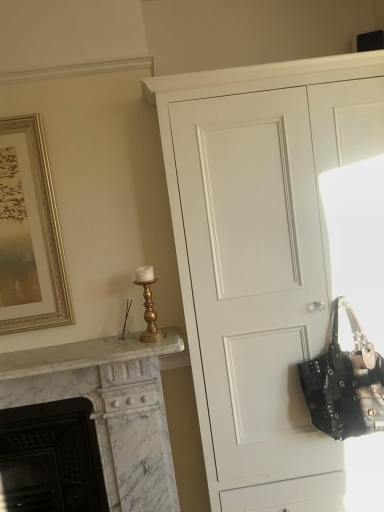
What do you see at coordinates (30, 233) in the screenshot? The width and height of the screenshot is (384, 512). I see `gold framed picture at upper left` at bounding box center [30, 233].

What do you see at coordinates (148, 305) in the screenshot? Image resolution: width=384 pixels, height=512 pixels. I see `gold metallic candlestick at upper left` at bounding box center [148, 305].

In order to face white matte cupboard at center, should I rotate leftwards or rightwards?

To align with it, rotate right about 14.891°.

Find the location of a particular element. This screenshot has height=512, width=384. gold framed picture at upper left is located at coordinates (30, 233).

Can you confirm if gold framed picture at upper left is thinner than white marble fireplace at left, the 2th fireplace when ordered from right to left?

Yes, gold framed picture at upper left is thinner than white marble fireplace at left, the 2th fireplace when ordered from right to left.

Is gold framed picture at upper left positioned far away from white marble fireplace at left, the 1th fireplace positioned from the left?

gold framed picture at upper left is near white marble fireplace at left, the 1th fireplace positioned from the left, not far away.

Between gold framed picture at upper left and white marble fireplace at left, the 1th fireplace positioned from the left, which one is positioned in front?

gold framed picture at upper left.

Considering the sizes of objects gold framed picture at upper left and white marble fireplace at left, the 2th fireplace when ordered from right to left, in the image provided, who is bigger, gold framed picture at upper left or white marble fireplace at left, the 2th fireplace when ordered from right to left,?

white marble fireplace at left, the 2th fireplace when ordered from right to left.

Is point (357, 390) farther from camera compared to point (31, 437)?

No, (357, 390) is in front of (31, 437).

Which of these two, studded leather handbag at right or white marble fireplace at left, the 2th fireplace when ordered from right to left, is smaller?

studded leather handbag at right is smaller.

From a real-world perspective, does studded leather handbag at right sit lower than white marble fireplace at left, the 1th fireplace positioned from the left?

No, from a real-world perspective, studded leather handbag at right is not under white marble fireplace at left, the 1th fireplace positioned from the left.

In terms of height, does studded leather handbag at right look taller or shorter compared to white marble fireplace at left, the 1th fireplace positioned from the left?

In the image, studded leather handbag at right appears to be shorter than white marble fireplace at left, the 1th fireplace positioned from the left.

In the scene shown: Can we say white marble fireplace at left, which is counted as the first fireplace, starting from the right, lies outside white marble fireplace at left, the 1th fireplace positioned from the left?

No, white marble fireplace at left, which is counted as the first fireplace, starting from the right, is not entirely external to white marble fireplace at left, the 1th fireplace positioned from the left.

Is white marble fireplace at left, which is counted as the first fireplace, starting from the right, in front of or behind white marble fireplace at left, the 2th fireplace when ordered from right to left, in the image?

In the image, white marble fireplace at left, which is counted as the first fireplace, starting from the right, appears in front of white marble fireplace at left, the 2th fireplace when ordered from right to left.

Does white marble fireplace at left, placed as the second fireplace when sorted from left to right, have a smaller size compared to white marble fireplace at left, the 1th fireplace positioned from the left?

No.

From the image's perspective, is white marble fireplace at left, placed as the second fireplace when sorted from left to right, under white marble fireplace at left, the 1th fireplace positioned from the left?

Incorrect, from the image's perspective, white marble fireplace at left, placed as the second fireplace when sorted from left to right, is higher than white marble fireplace at left, the 1th fireplace positioned from the left.

Does white matte cupboard at center turn towards studded leather handbag at right?

Yes.

Which is more to the left, white matte cupboard at center or studded leather handbag at right?

From the viewer's perspective, white matte cupboard at center appears more on the left side.

From the image's perspective, which one is positioned higher, white matte cupboard at center or studded leather handbag at right?

white matte cupboard at center, from the image's perspective.

Does white matte cupboard at center contain studded leather handbag at right?

Yes, studded leather handbag at right is surrounded by white matte cupboard at center.

Is the position of gold metallic candlestick at upper left less distant than that of studded leather handbag at right?

No, it is not.

The width and height of the screenshot is (384, 512). Identify the location of table lamp above the studded leather handbag at right (from a real-world perspective). (148, 305).

Would you consider gold metallic candlestick at upper left to be distant from studded leather handbag at right?

No, gold metallic candlestick at upper left is in close proximity to studded leather handbag at right.

Between gold metallic candlestick at upper left and studded leather handbag at right, which one has smaller size?

gold metallic candlestick at upper left is smaller.

Is studded leather handbag at right oriented away from white marble fireplace at left, which is counted as the first fireplace, starting from the right?

No.

Does studded leather handbag at right appear on the left side of white marble fireplace at left, which is counted as the first fireplace, starting from the right?

No, studded leather handbag at right is not to the left of white marble fireplace at left, which is counted as the first fireplace, starting from the right.

Which is in front, point (358, 421) or point (78, 393)?

The point (358, 421) is closer.

Considering the relative sizes of studded leather handbag at right and white marble fireplace at left, placed as the second fireplace when sorted from left to right, in the image provided, is studded leather handbag at right wider than white marble fireplace at left, placed as the second fireplace when sorted from left to right,?

No.

Does gold metallic candlestick at upper left have a greater width compared to white matte cupboard at center?

Incorrect, the width of gold metallic candlestick at upper left does not surpass that of white matte cupboard at center.

Which object is positioned more to the right, gold metallic candlestick at upper left or white matte cupboard at center?

white matte cupboard at center.

From the image's perspective, between gold metallic candlestick at upper left and white matte cupboard at center, who is located below?

white matte cupboard at center appears lower in the image.

The image size is (384, 512). What are the coordinates of `cupboard directly beneath the gold metallic candlestick at upper left (from a real-world perspective)` in the screenshot? It's located at pyautogui.click(x=261, y=258).

The image size is (384, 512). Identify the location of picture frame located above the white marble fireplace at left, the 1th fireplace positioned from the left (from a real-world perspective). (30, 233).

From the image's perspective, starting from the studded leather handbag at right, which fireplace is the 2nd one below? Please provide its 2D coordinates.

[(51, 458)]

Based on the photo, looking at the image, which one is located further to white marble fireplace at left, placed as the second fireplace when sorted from left to right, white matte cupboard at center or white marble fireplace at left, the 1th fireplace positioned from the left?

white matte cupboard at center lies further to white marble fireplace at left, placed as the second fireplace when sorted from left to right, than the other object.

When comparing their distances from gold framed picture at upper left, does white marble fireplace at left, placed as the second fireplace when sorted from left to right, or gold metallic candlestick at upper left seem further?

gold metallic candlestick at upper left.

Which object lies further to the anchor point gold framed picture at upper left, studded leather handbag at right or gold metallic candlestick at upper left?

studded leather handbag at right.

Looking at the image, which one is located further to white marble fireplace at left, which is counted as the first fireplace, starting from the right, white marble fireplace at left, the 1th fireplace positioned from the left, or gold metallic candlestick at upper left?

Among the two, gold metallic candlestick at upper left is located further to white marble fireplace at left, which is counted as the first fireplace, starting from the right.

Consider the image. Looking at the image, which one is located further to white marble fireplace at left, the 1th fireplace positioned from the left, studded leather handbag at right or white marble fireplace at left, placed as the second fireplace when sorted from left to right?

Based on the image, studded leather handbag at right appears to be further to white marble fireplace at left, the 1th fireplace positioned from the left.

Looking at the image, which one is located closer to white marble fireplace at left, the 1th fireplace positioned from the left, white matte cupboard at center or studded leather handbag at right?

white matte cupboard at center lies closer to white marble fireplace at left, the 1th fireplace positioned from the left, than the other object.

Estimate the real-world distances between objects in this image. Which object is further from gold framed picture at upper left, white marble fireplace at left, the 1th fireplace positioned from the left, or gold metallic candlestick at upper left?

white marble fireplace at left, the 1th fireplace positioned from the left.

Estimate the real-world distances between objects in this image. Which object is closer to white marble fireplace at left, which is counted as the first fireplace, starting from the right, gold framed picture at upper left or gold metallic candlestick at upper left?

The object closer to white marble fireplace at left, which is counted as the first fireplace, starting from the right, is gold metallic candlestick at upper left.

Find the location of a particular element. The width and height of the screenshot is (384, 512). table lamp situated between white marble fireplace at left, the 2th fireplace when ordered from right to left, and white matte cupboard at center from left to right is located at coordinates (148, 305).

Image resolution: width=384 pixels, height=512 pixels. I want to click on table lamp located between white marble fireplace at left, the 1th fireplace positioned from the left, and studded leather handbag at right in the left-right direction, so click(x=148, y=305).

The width and height of the screenshot is (384, 512). I want to click on fireplace between white marble fireplace at left, the 1th fireplace positioned from the left, and studded leather handbag at right, so click(109, 408).

This screenshot has width=384, height=512. What are the coordinates of `fireplace between gold metallic candlestick at upper left and white marble fireplace at left, the 1th fireplace positioned from the left, from top to bottom` in the screenshot? It's located at (109, 408).